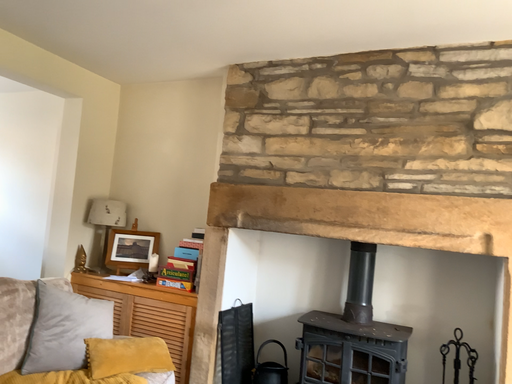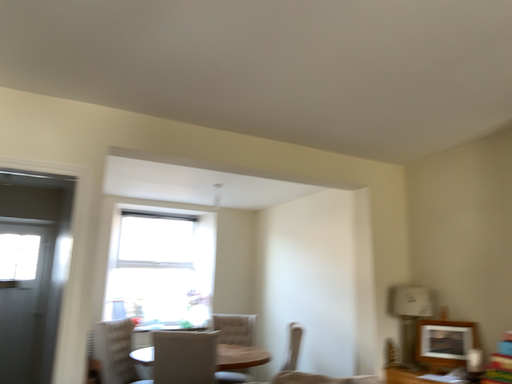
Question: How did the camera likely rotate when shooting the video?

Choices:
 (A) rotated right
 (B) rotated left

Answer: (B)